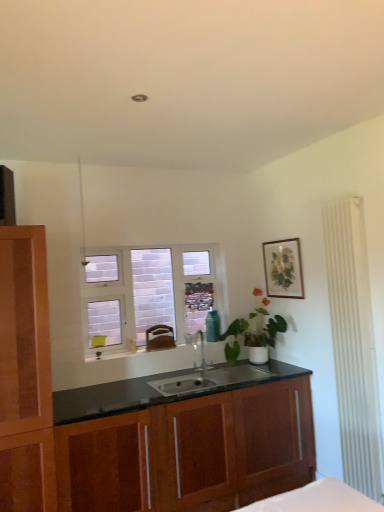
Question: From the image's perspective, does wooden cabinet at center appear higher than white frosted glass window at center?

Choices:
 (A) no
 (B) yes

Answer: (A)

Question: Is white frosted glass window at center located within wooden cabinet at center?

Choices:
 (A) yes
 (B) no

Answer: (B)

Question: Does wooden cabinet at center have a greater width compared to white frosted glass window at center?

Choices:
 (A) yes
 (B) no

Answer: (A)

Question: From a real-world perspective, is wooden cabinet at center located beneath white frosted glass window at center?

Choices:
 (A) no
 (B) yes

Answer: (B)

Question: From the image's perspective, is wooden cabinet at center beneath white frosted glass window at center?

Choices:
 (A) no
 (B) yes

Answer: (B)

Question: Considering their positions, is satin nickel faucet at center located in front of or behind matte wooden picture frame at upper right?

Choices:
 (A) front
 (B) behind

Answer: (A)

Question: In the image, is satin nickel faucet at center on the left side or the right side of matte wooden picture frame at upper right?

Choices:
 (A) left
 (B) right

Answer: (A)

Question: From the image's perspective, is satin nickel faucet at center located above or below matte wooden picture frame at upper right?

Choices:
 (A) below
 (B) above

Answer: (A)

Question: In terms of width, does satin nickel faucet at center look wider or thinner when compared to matte wooden picture frame at upper right?

Choices:
 (A) thin
 (B) wide

Answer: (B)

Question: Is wooden cabinet at center wider or thinner than matte wooden picture frame at upper right?

Choices:
 (A) thin
 (B) wide

Answer: (B)

Question: In the image, is wooden cabinet at center positioned in front of or behind matte wooden picture frame at upper right?

Choices:
 (A) front
 (B) behind

Answer: (A)

Question: From a real-world perspective, is wooden cabinet at center physically located above or below matte wooden picture frame at upper right?

Choices:
 (A) below
 (B) above

Answer: (A)

Question: From the image's perspective, is wooden cabinet at center located above or below matte wooden picture frame at upper right?

Choices:
 (A) above
 (B) below

Answer: (B)

Question: From the image's perspective, is white frosted glass window at center above or below matte wooden picture frame at upper right?

Choices:
 (A) below
 (B) above

Answer: (A)

Question: Considering the positions of point click(107, 346) and point click(279, 292), is point click(107, 346) closer or farther from the camera than point click(279, 292)?

Choices:
 (A) closer
 (B) farther

Answer: (A)